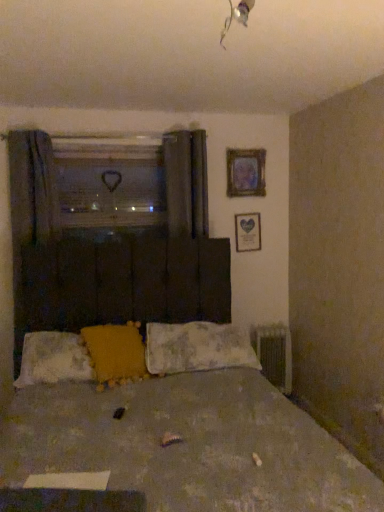
What are the coordinates of `dark gray fabric curtain at left` in the screenshot? It's located at (30, 216).

You are a GUI agent. You are given a task and a screenshot of the screen. Output one action in this format:
    pyautogui.click(x=<x>, y=<y>)
    Task: Click on the yellow fabric pillow at center, the 2th pillow viewed from the left
    This screenshot has height=512, width=384.
    Given the screenshot: What is the action you would take?
    pyautogui.click(x=116, y=353)

This screenshot has width=384, height=512. I want to click on clear plastic heart at upper center, so click(110, 181).

Measure the distance between fluffy white pillow at lower left, marked as the 3th pillow in a right-to-left arrangement, and camera.

They are 7.71 feet apart.

Image resolution: width=384 pixels, height=512 pixels. Identify the location of metallic silver radiator at lower right. (275, 354).

Identify the location of wooden heart-shaped frame at upper right, the second picture frame from the top. (248, 232).

Is worn fabric bed at center oriented towards clear plastic heart at upper center?

No, worn fabric bed at center is not turned towards clear plastic heart at upper center.

Considering the relative sizes of worn fabric bed at center and clear plastic heart at upper center in the image provided, is worn fabric bed at center wider than clear plastic heart at upper center?

Correct, the width of worn fabric bed at center exceeds that of clear plastic heart at upper center.

From the image's perspective, which is above, worn fabric bed at center or clear plastic heart at upper center?

clear plastic heart at upper center.

Looking at this image, does worn fabric bed at center lie behind clear plastic heart at upper center?

That is False.

Does point (208, 360) appear closer or farther from the camera than point (13, 159)?

Point (208, 360).

From a real-world perspective, which object rests below the other?

fluffy fabric pillow at center, which is the 3th pillow from left to right, from a real-world perspective.

Between fluffy fabric pillow at center, which is the 3th pillow from left to right, and dark gray fabric curtain at left, which one appears on the right side from the viewer's perspective?

From the viewer's perspective, fluffy fabric pillow at center, which is the 3th pillow from left to right, appears more on the right side.

Are fluffy fabric pillow at center, arranged as the 1th pillow when viewed from the right, and dark gray fabric curtain at left far apart?

Absolutely, fluffy fabric pillow at center, arranged as the 1th pillow when viewed from the right, is distant from dark gray fabric curtain at left.

Would you say yellow fabric pillow at center, marked as the second pillow in a right-to-left arrangement, is part of wooden heart-shaped frame at upper right, the second picture frame from the top,'s contents?

Definitely not — yellow fabric pillow at center, marked as the second pillow in a right-to-left arrangement, is not inside wooden heart-shaped frame at upper right, the second picture frame from the top.

Who is shorter, wooden heart-shaped frame at upper right, which is the 1th picture frame in bottom-to-top order, or yellow fabric pillow at center, marked as the second pillow in a right-to-left arrangement?

Standing shorter between the two is yellow fabric pillow at center, marked as the second pillow in a right-to-left arrangement.

Which of these two, wooden heart-shaped frame at upper right, which is the 1th picture frame in bottom-to-top order, or yellow fabric pillow at center, marked as the second pillow in a right-to-left arrangement, is bigger?

Bigger between the two is yellow fabric pillow at center, marked as the second pillow in a right-to-left arrangement.

Between point (84, 161) and point (27, 351), which one is positioned behind?

Positioned behind is point (84, 161).

Identify the location of the 2nd pillow in front of the clear plastic heart at upper center, counting from the anchor's position. This screenshot has height=512, width=384. (54, 359).

Can you see clear plastic heart at upper center touching fluffy white pillow at lower left, marked as the 3th pillow in a right-to-left arrangement?

No, clear plastic heart at upper center is not beside fluffy white pillow at lower left, marked as the 3th pillow in a right-to-left arrangement.

From the image's perspective, which is above, clear plastic heart at upper center or fluffy white pillow at lower left, the 1th pillow in the left-to-right sequence?

clear plastic heart at upper center is shown above in the image.

Which is correct: fluffy white pillow at lower left, the 1th pillow in the left-to-right sequence, is inside matte glass picture frame at upper right, acting as the first picture frame starting from the top, or outside of it?

fluffy white pillow at lower left, the 1th pillow in the left-to-right sequence, is outside matte glass picture frame at upper right, acting as the first picture frame starting from the top.

Are fluffy white pillow at lower left, marked as the 3th pillow in a right-to-left arrangement, and matte glass picture frame at upper right, positioned as the 2th picture frame in bottom-to-top order, beside each other?

No, fluffy white pillow at lower left, marked as the 3th pillow in a right-to-left arrangement, is not touching matte glass picture frame at upper right, positioned as the 2th picture frame in bottom-to-top order.

Is matte glass picture frame at upper right, positioned as the 2th picture frame in bottom-to-top order, at the back of fluffy white pillow at lower left, the 1th pillow in the left-to-right sequence?

fluffy white pillow at lower left, the 1th pillow in the left-to-right sequence, does not have its back to matte glass picture frame at upper right, positioned as the 2th picture frame in bottom-to-top order.

Is worn fabric bed at center completely or partially outside of wooden heart-shaped frame at upper right, which is the 1th picture frame in bottom-to-top order?

worn fabric bed at center lies outside wooden heart-shaped frame at upper right, which is the 1th picture frame in bottom-to-top order,'s area.

Is worn fabric bed at center to the left of wooden heart-shaped frame at upper right, which is the 1th picture frame in bottom-to-top order, from the viewer's perspective?

Yes, worn fabric bed at center is to the left of wooden heart-shaped frame at upper right, which is the 1th picture frame in bottom-to-top order.

Which of these two, worn fabric bed at center or wooden heart-shaped frame at upper right, which is the 1th picture frame in bottom-to-top order, is smaller?

wooden heart-shaped frame at upper right, which is the 1th picture frame in bottom-to-top order, is smaller.

Are wooden heart-shaped frame at upper right, the second picture frame from the top, and matte glass picture frame at upper right, acting as the first picture frame starting from the top, making contact?

They are not placed beside each other.

Is wooden heart-shaped frame at upper right, which is the 1th picture frame in bottom-to-top order, facing away from matte glass picture frame at upper right, acting as the first picture frame starting from the top?

No, matte glass picture frame at upper right, acting as the first picture frame starting from the top, is not at the back of wooden heart-shaped frame at upper right, which is the 1th picture frame in bottom-to-top order.

Does wooden heart-shaped frame at upper right, the second picture frame from the top, come behind matte glass picture frame at upper right, acting as the first picture frame starting from the top?

Yes, the depth of wooden heart-shaped frame at upper right, the second picture frame from the top, is greater than that of matte glass picture frame at upper right, acting as the first picture frame starting from the top.

This screenshot has height=512, width=384. I want to click on picture frame behind the matte glass picture frame at upper right, positioned as the 2th picture frame in bottom-to-top order, so click(x=248, y=232).

Locate an element on the screen. The height and width of the screenshot is (512, 384). bed on the right of clear plastic heart at upper center is located at coordinates (181, 430).

Where is `curtain that is above the fluffy fabric pillow at center, arranged as the 1th pillow when viewed from the right (from a real-world perspective)`? curtain that is above the fluffy fabric pillow at center, arranged as the 1th pillow when viewed from the right (from a real-world perspective) is located at coordinates (30, 216).

Which object lies nearer to the anchor point fluffy fabric pillow at center, which is the 3th pillow from left to right, metallic silver radiator at lower right or dark gray fabric curtain at left?

Based on the image, metallic silver radiator at lower right appears to be nearer to fluffy fabric pillow at center, which is the 3th pillow from left to right.

Consider the image. Looking at the image, which one is located further to wooden heart-shaped frame at upper right, the second picture frame from the top, yellow fabric pillow at center, marked as the second pillow in a right-to-left arrangement, or fluffy fabric pillow at center, arranged as the 1th pillow when viewed from the right?

yellow fabric pillow at center, marked as the second pillow in a right-to-left arrangement, is positioned further to the anchor wooden heart-shaped frame at upper right, the second picture frame from the top.

When comparing their distances from wooden heart-shaped frame at upper right, which is the 1th picture frame in bottom-to-top order, does matte glass picture frame at upper right, acting as the first picture frame starting from the top, or dark gray fabric curtain at left seem further?

dark gray fabric curtain at left lies further to wooden heart-shaped frame at upper right, which is the 1th picture frame in bottom-to-top order, than the other object.

Based on their spatial positions, is dark gray fabric curtain at left or wooden heart-shaped frame at upper right, which is the 1th picture frame in bottom-to-top order, closer to clear plastic heart at upper center?

Based on the image, dark gray fabric curtain at left appears to be nearer to clear plastic heart at upper center.

Based on their spatial positions, is yellow fabric pillow at center, marked as the second pillow in a right-to-left arrangement, or clear plastic heart at upper center further from fluffy white pillow at lower left, marked as the 3th pillow in a right-to-left arrangement?

Based on the image, clear plastic heart at upper center appears to be further to fluffy white pillow at lower left, marked as the 3th pillow in a right-to-left arrangement.

Estimate the real-world distances between objects in this image. Which object is closer to fluffy white pillow at lower left, marked as the 3th pillow in a right-to-left arrangement, yellow fabric pillow at center, marked as the second pillow in a right-to-left arrangement, or matte glass picture frame at upper right, positioned as the 2th picture frame in bottom-to-top order?

Among the two, yellow fabric pillow at center, marked as the second pillow in a right-to-left arrangement, is located nearer to fluffy white pillow at lower left, marked as the 3th pillow in a right-to-left arrangement.

Considering their positions, is fluffy white pillow at lower left, marked as the 3th pillow in a right-to-left arrangement, positioned further to dark gray fabric curtain at left than clear plastic heart at upper center?

fluffy white pillow at lower left, marked as the 3th pillow in a right-to-left arrangement, is further to dark gray fabric curtain at left.

Based on the photo, from the image, which object appears to be farther from dark gray fabric curtain at left, metallic silver radiator at lower right or worn fabric bed at center?

metallic silver radiator at lower right is further to dark gray fabric curtain at left.

I want to click on window screen between matte glass picture frame at upper right, acting as the first picture frame starting from the top, and fluffy fabric pillow at center, arranged as the 1th pillow when viewed from the right, vertically, so click(x=110, y=181).

Where is `picture frame between matte glass picture frame at upper right, acting as the first picture frame starting from the top, and metallic silver radiator at lower right from top to bottom`? This screenshot has height=512, width=384. picture frame between matte glass picture frame at upper right, acting as the first picture frame starting from the top, and metallic silver radiator at lower right from top to bottom is located at coordinates (248, 232).

This screenshot has height=512, width=384. In order to click on curtain between worn fabric bed at center and matte glass picture frame at upper right, acting as the first picture frame starting from the top, along the z-axis in this screenshot , I will do `click(30, 216)`.

You are a GUI agent. You are given a task and a screenshot of the screen. Output one action in this format:
    pyautogui.click(x=<x>, y=<y>)
    Task: Click on the pillow between clear plastic heart at upper center and fluffy fabric pillow at center, which is the 3th pillow from left to right, from top to bottom
    This screenshot has width=384, height=512.
    Given the screenshot: What is the action you would take?
    pyautogui.click(x=116, y=353)